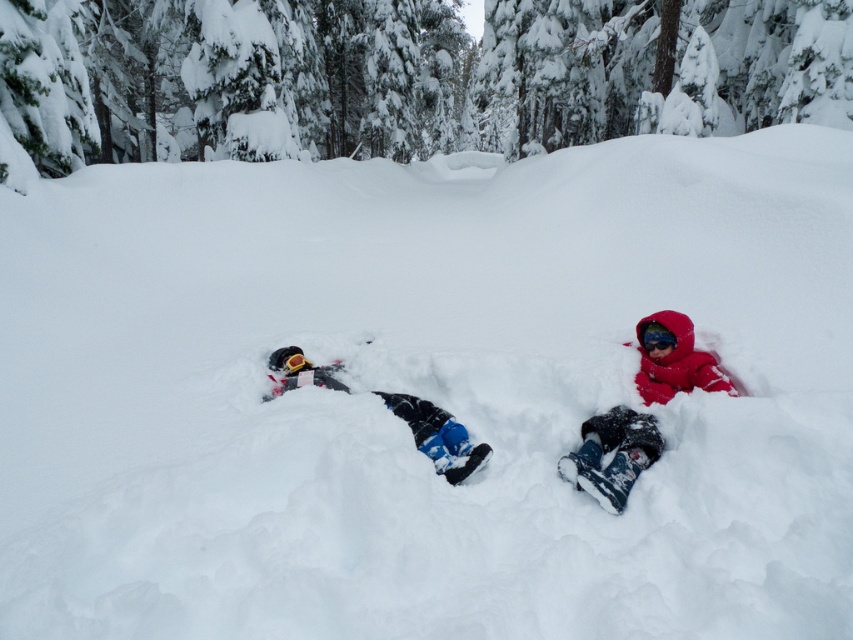
Question: Which point is closer to the camera taking this photo?

Choices:
 (A) (318, 369)
 (B) (616, 474)

Answer: (B)

Question: Does red fleece snowsuit at center have a smaller size compared to matte black snow angel at center?

Choices:
 (A) yes
 (B) no

Answer: (B)

Question: Can you confirm if red fleece snowsuit at center is positioned below matte black snow angel at center?

Choices:
 (A) no
 (B) yes

Answer: (A)

Question: Is red fleece snowsuit at center thinner than matte black snow angel at center?

Choices:
 (A) yes
 (B) no

Answer: (B)